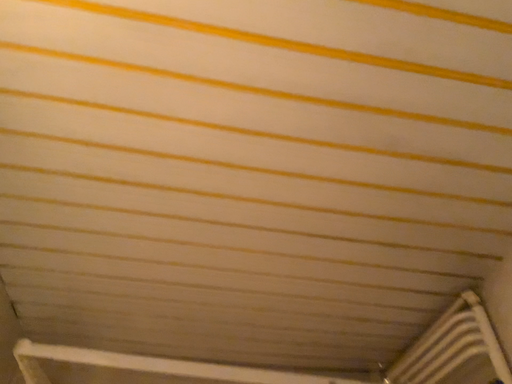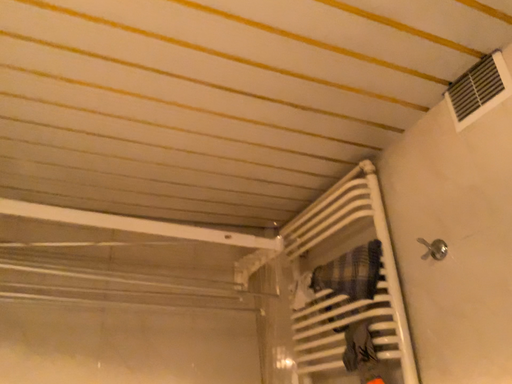
Question: Which way did the camera rotate in the video?

Choices:
 (A) rotated upward
 (B) rotated downward

Answer: (B)